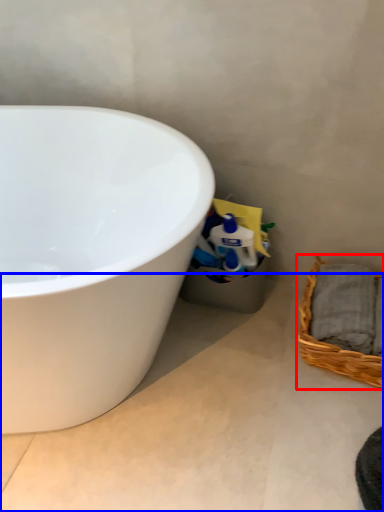
Question: Which object is further to the camera taking this photo, picnic basket (highlighted by a red box) or concrete (highlighted by a blue box)?

Choices:
 (A) picnic basket
 (B) concrete

Answer: (A)